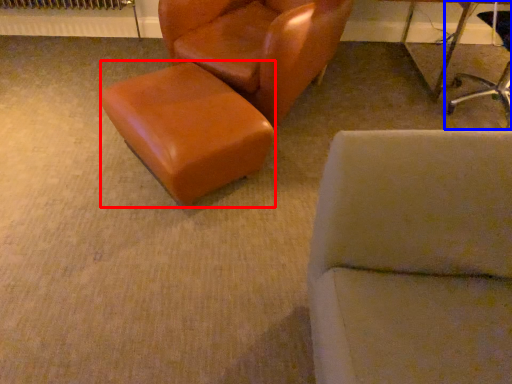
Question: Among these objects, which one is nearest to the camera, stool (highlighted by a red box) or chair (highlighted by a blue box)?

Choices:
 (A) stool
 (B) chair

Answer: (A)